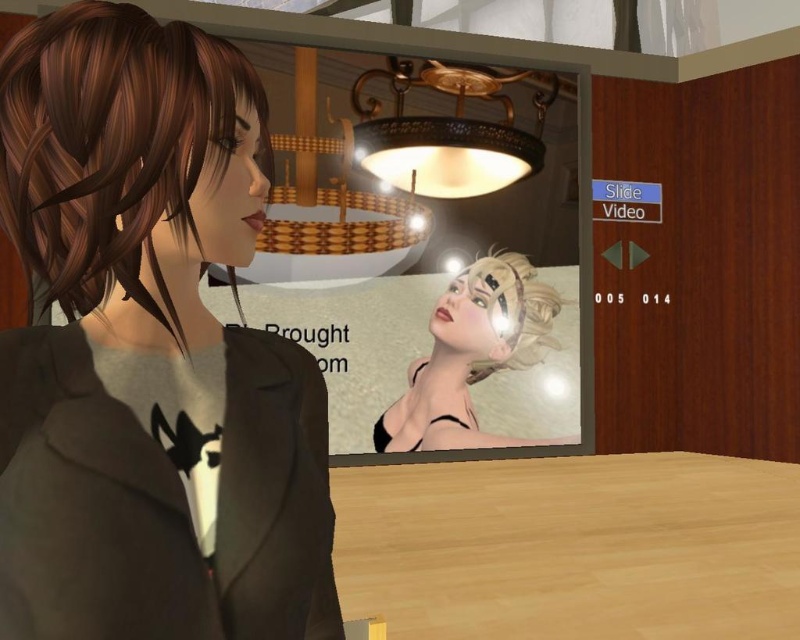
Is point (404, 403) more distant than point (500, 339)?

No, it is not.

Does matte black screen at upper center appear over smooth beige headband at center?

Indeed, matte black screen at upper center is positioned over smooth beige headband at center.

You are a GUI agent. You are given a task and a screenshot of the screen. Output one action in this format:
    pyautogui.click(x=<x>, y=<y>)
    Task: Click on the matte black screen at upper center
    The width and height of the screenshot is (800, 640).
    Given the screenshot: What is the action you would take?
    pyautogui.click(x=428, y=248)

I want to click on matte black screen at upper center, so click(428, 248).

Can you confirm if matte black screen at upper center is smaller than shiny brown hair at left?

Actually, matte black screen at upper center might be larger than shiny brown hair at left.

Can you confirm if matte black screen at upper center is positioned to the left of shiny brown hair at left?

In fact, matte black screen at upper center is to the right of shiny brown hair at left.

I want to click on matte black screen at upper center, so click(x=428, y=248).

Where is `matte black screen at upper center`? The image size is (800, 640). matte black screen at upper center is located at coordinates (428, 248).

Image resolution: width=800 pixels, height=640 pixels. What do you see at coordinates (150, 349) in the screenshot?
I see `matte gray hoodie at center` at bounding box center [150, 349].

Does matte gray hoodie at center come in front of shiny brown hair at left?

That is True.

Which is behind, point (88, 500) or point (234, 84)?

Point (234, 84)

Locate an element on the screen. Image resolution: width=800 pixels, height=640 pixels. matte gray hoodie at center is located at coordinates (150, 349).